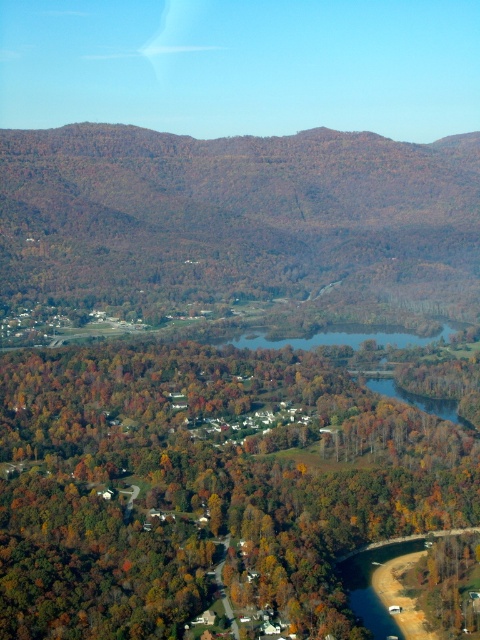
Question: Which is nearer to the brown textured mountain at upper left?

Choices:
 (A) green matte tree at center
 (B) blue water at center

Answer: (B)

Question: Which of the following is the farthest from the observer?

Choices:
 (A) (50, 490)
 (B) (456, 208)
 (C) (395, 326)

Answer: (B)

Question: In this image, where is green matte tree at center located relative to brown textured mountain at upper left?

Choices:
 (A) below
 (B) above

Answer: (A)

Question: Is green matte tree at center smaller than blue water at center?

Choices:
 (A) no
 (B) yes

Answer: (A)

Question: Does green matte tree at center have a greater width compared to brown textured mountain at upper left?

Choices:
 (A) yes
 (B) no

Answer: (B)

Question: Among these objects, which one is nearest to the camera?

Choices:
 (A) green matte tree at center
 (B) brown textured mountain at upper left
 (C) blue water at center

Answer: (A)